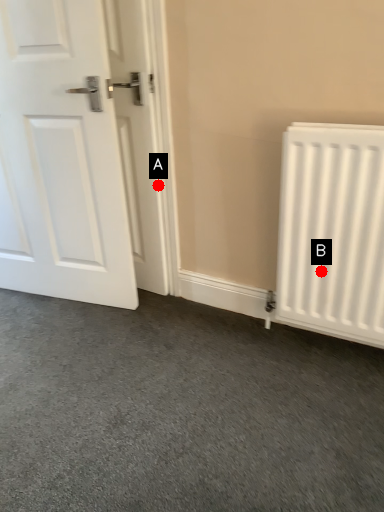
Question: Two points are circled on the image, labeled by A and B beside each circle. Which of the following is the closest to the observer?

Choices:
 (A) A is closer
 (B) B is closer

Answer: (B)